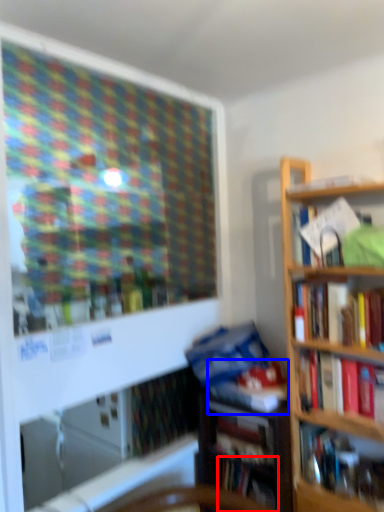
Question: Among these objects, which one is farthest to the camera, book (highlighted by a red box) or book (highlighted by a blue box)?

Choices:
 (A) book
 (B) book

Answer: (A)